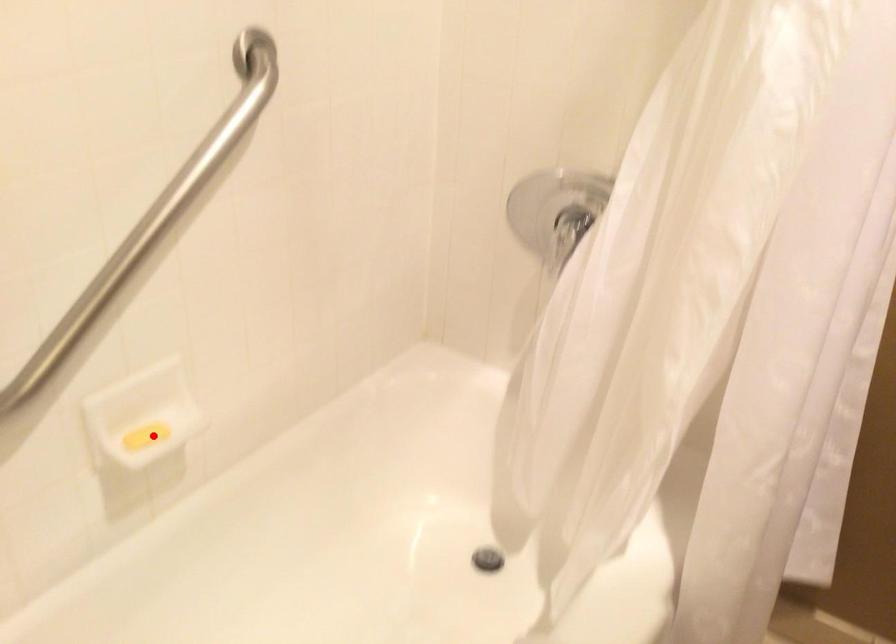
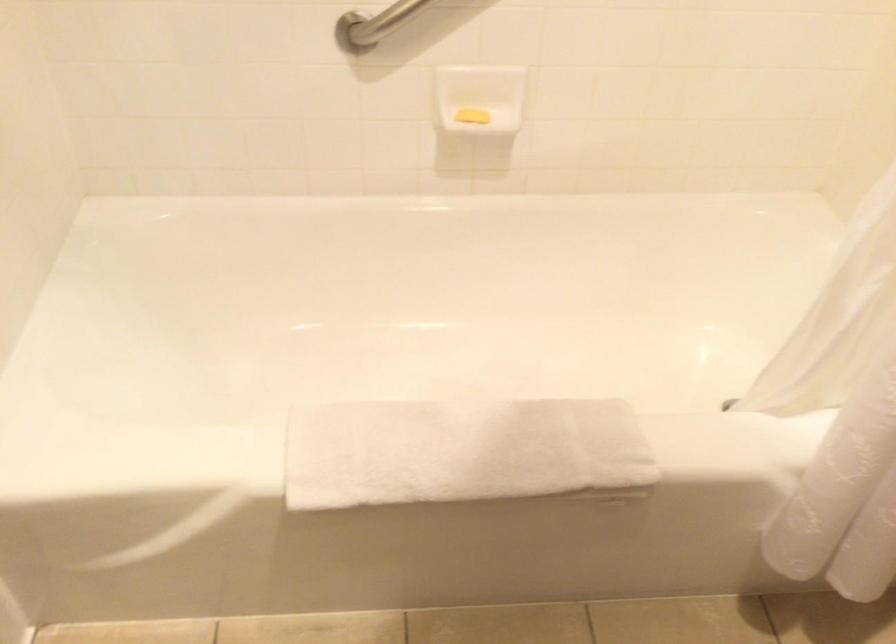
In the second image, find the point that corresponds to the highlighted location in the first image.

(471, 116)